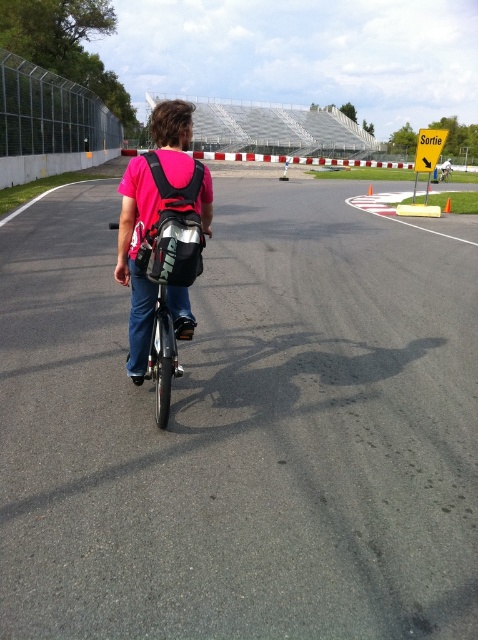
Question: Can you confirm if pink fabric shirt at center is thinner than shiny metallic bicycle at center?

Choices:
 (A) yes
 (B) no

Answer: (B)

Question: Which object is the closest to the black fabric backpack at center?

Choices:
 (A) asphalt at center
 (B) shiny metallic bicycle at center
 (C) pink fabric shirt at center
 (D) orange plastic cone at center

Answer: (C)

Question: Which point appears farthest from the camera in this image?

Choices:
 (A) (447, 211)
 (B) (153, 179)

Answer: (A)

Question: Does black fabric backpack at center have a larger size compared to shiny metallic bicycle at center?

Choices:
 (A) yes
 (B) no

Answer: (B)

Question: Which of these objects is positioned farthest from the shiny metallic bicycle at center?

Choices:
 (A) pink fabric shirt at center
 (B) orange plastic cone at center
 (C) asphalt at center

Answer: (B)

Question: Can you confirm if asphalt at center is positioned below black fabric backpack at center?

Choices:
 (A) yes
 (B) no

Answer: (B)